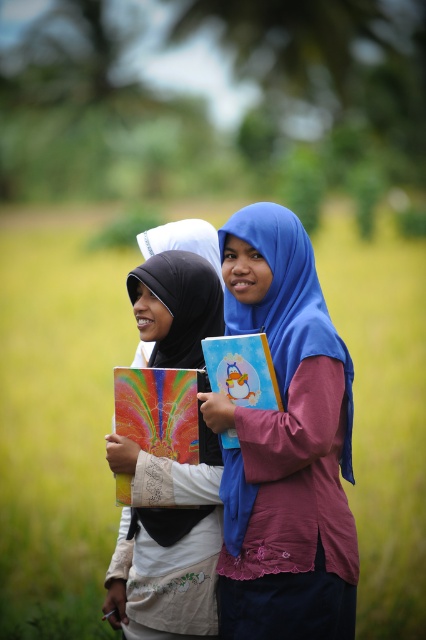
Does matte black hijab at left have a greater height compared to matte paper coloring book at center?

Yes, matte black hijab at left is taller than matte paper coloring book at center.

Measure the distance between matte black hijab at left and matte paper coloring book at center.

The distance of matte black hijab at left from matte paper coloring book at center is 13.86 inches.

Who is more forward, [132,611] or [201,342]?

Point [132,611]

Locate an element on the screen. The image size is (426, 640). matte black hijab at left is located at coordinates (166, 541).

Does matte blue hijab at center have a larger size compared to matte paper coloring book at center?

Correct, matte blue hijab at center is larger in size than matte paper coloring book at center.

Is matte blue hijab at center in front of matte paper coloring book at center?

Yes, matte blue hijab at center is in front of matte paper coloring book at center.

The width and height of the screenshot is (426, 640). What do you see at coordinates (284, 445) in the screenshot?
I see `matte blue hijab at center` at bounding box center [284, 445].

Locate an element on the screen. matte blue hijab at center is located at coordinates (284, 445).

Does rainbow matte coloring book at center have a smaller size compared to matte paper coloring book at center?

No, rainbow matte coloring book at center is not smaller than matte paper coloring book at center.

Can you confirm if rainbow matte coloring book at center is thinner than matte paper coloring book at center?

In fact, rainbow matte coloring book at center might be wider than matte paper coloring book at center.

At what (x,y) coordinates should I click in order to perform the action: click on rainbow matte coloring book at center. Please return your answer as a coordinate pair (x, y). Looking at the image, I should click on point(161,410).

Where is `rainbow matte coloring book at center`? rainbow matte coloring book at center is located at coordinates (161, 410).